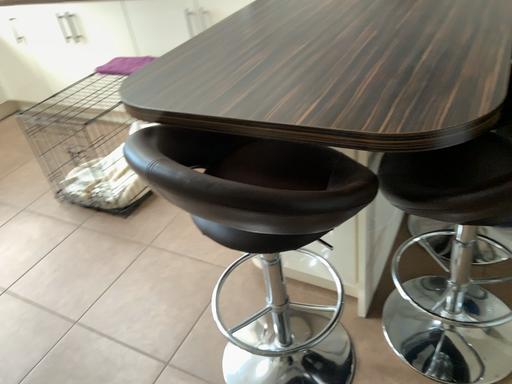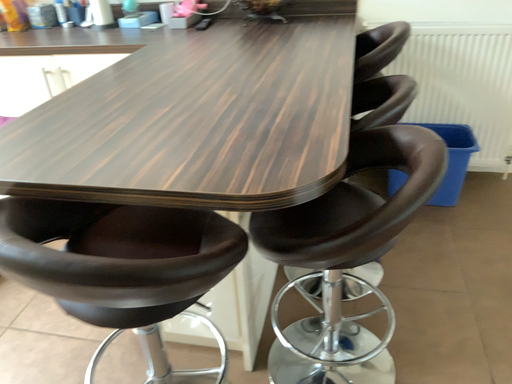
Question: Which way did the camera rotate in the video?

Choices:
 (A) rotated right
 (B) rotated left

Answer: (A)